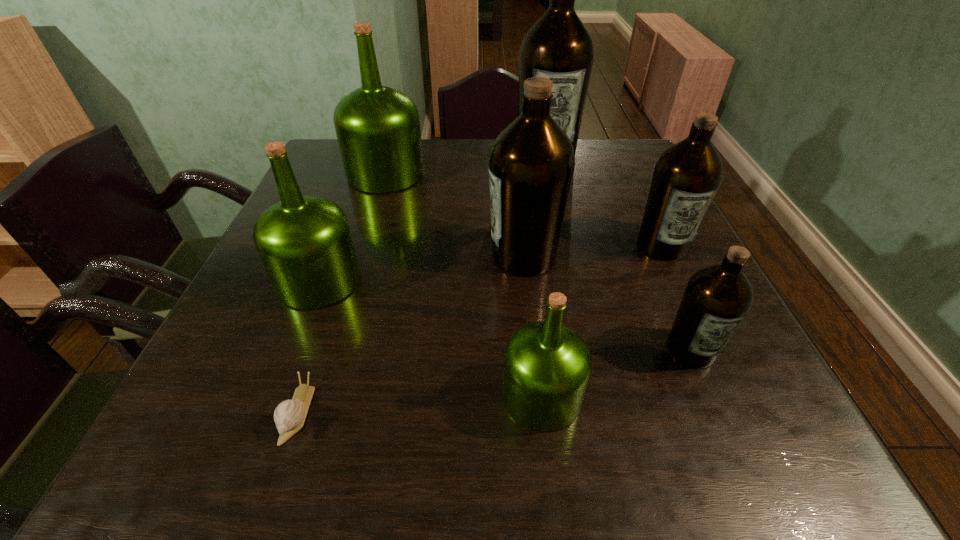
Select which brown olive oil is the second closest to the second biggest brown olive oil. Please provide its 2D coordinates. Your answer should be formatted as a tuple, i.e. [(x, y)], where the tuple contains the x and y coordinates of a point satisfying the conditions above.

[(716, 299)]

Select which brown olive oil is the closest to the farthest brown olive oil. Please provide its 2D coordinates. Your answer should be formatted as a tuple, i.e. [(x, y)], where the tuple contains the x and y coordinates of a point satisfying the conditions above.

[(686, 177)]

The height and width of the screenshot is (540, 960). Identify the location of green olive oil object that ranks as the closest to the smallest green olive oil. (305, 244).

Identify which green olive oil is located as the nearest to the biggest green olive oil. Please provide its 2D coordinates. Your answer should be formatted as a tuple, i.e. [(x, y)], where the tuple contains the x and y coordinates of a point satisfying the conditions above.

[(305, 244)]

Find the location of a particular element. The height and width of the screenshot is (540, 960). vacant space that satisfies the following two spatial constraints: 1. on the label of the second biggest brown olive oil; 2. on the right side of the smallest green olive oil is located at coordinates (540, 396).

The image size is (960, 540). In order to click on vacant region that satisfies the following two spatial constraints: 1. on the front side of the second nearest green olive oil; 2. on the right side of the nearest green olive oil in this screenshot , I will do `click(274, 396)`.